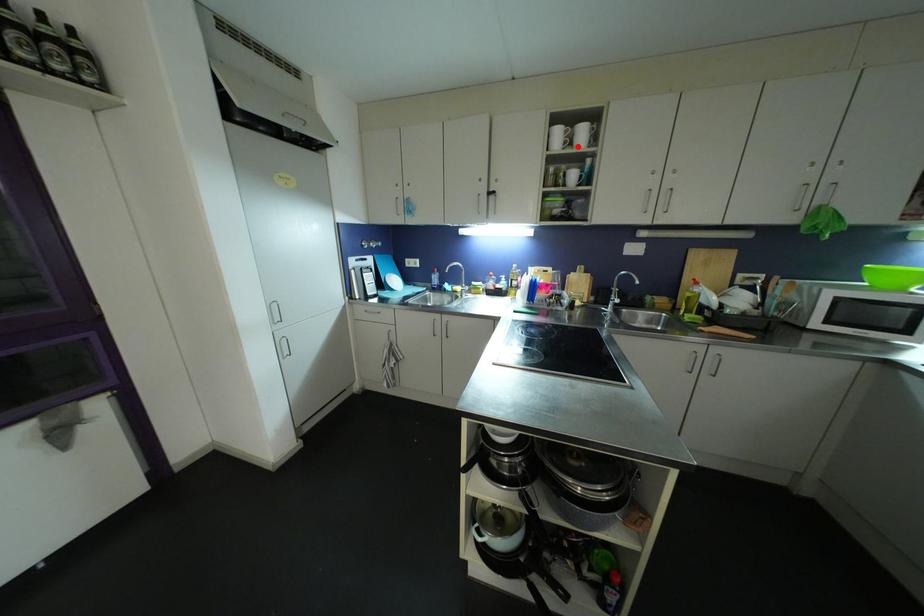
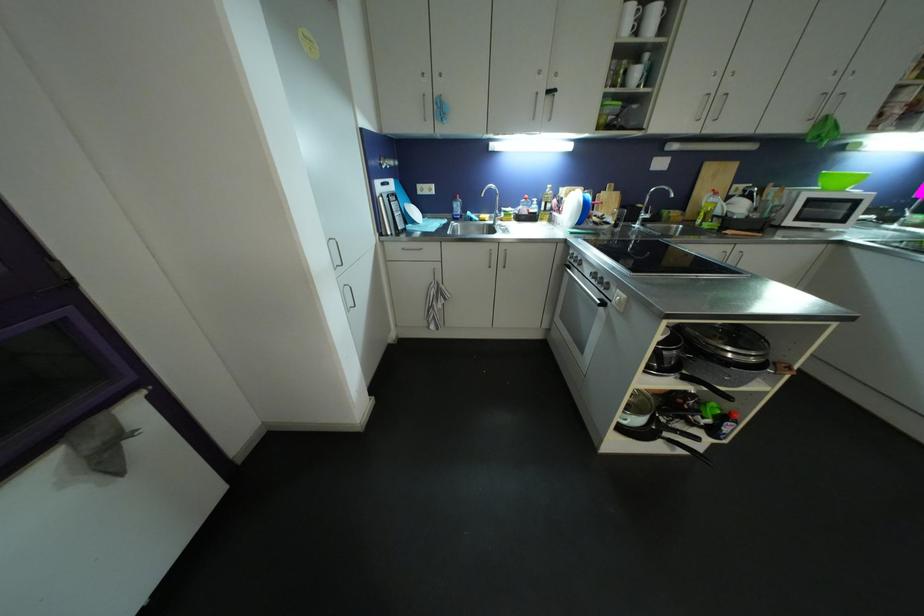
In the second image, find the point that corresponds to the highlighted location in the first image.

(643, 34)